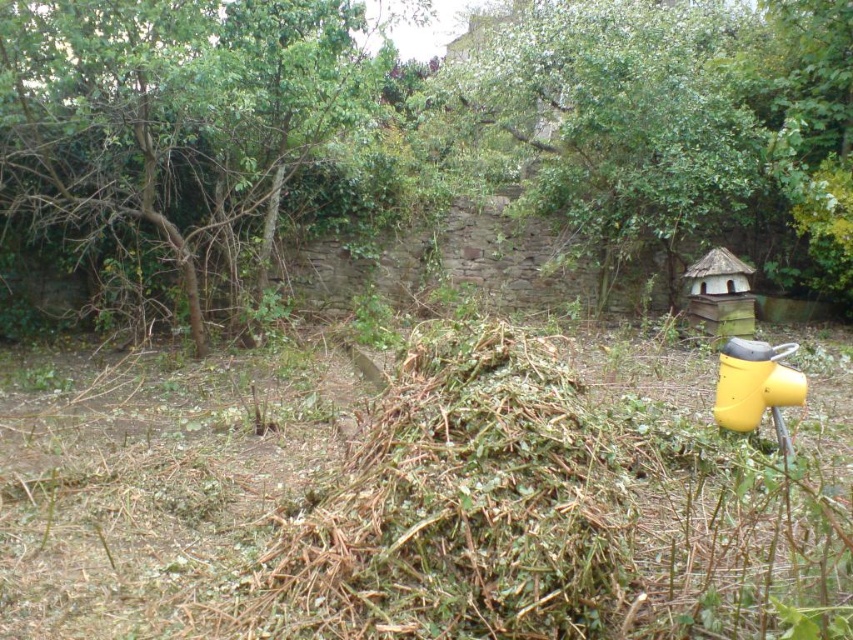
You are a gardener who needs to water the green leafy tree at upper center using the yellow plastic hydrant at lower right. Can you reach the tree with the hydrant hose if the hose is 10 meters long?

The green leafy tree at upper center is located above the yellow plastic hydrant at lower right. Since the hydrant is at lower right and the tree is above it, the vertical distance between them must be considered. However, the horizontal distance isn not specified. Assuming the hose can reach vertically, the 10 meters should be sufficient as vertical distance is likely less than 10 meters. Therefore, yes, the hose can reach.

You are a gardener who needs to water the green leafy tree at upper left and the yellow plastic hydrant at lower right. Which object requires more water because of its size?

The green leafy tree at upper left requires more water because it is bigger than the yellow plastic hydrant at lower right.

You are a gardener looking at the two green leafy trees in the garden. Which tree is closer to you, the green leafy tree at upper left or the green leafy tree at upper center?

The green leafy tree at upper left is closer to you because it is in front of the green leafy tree at upper center.